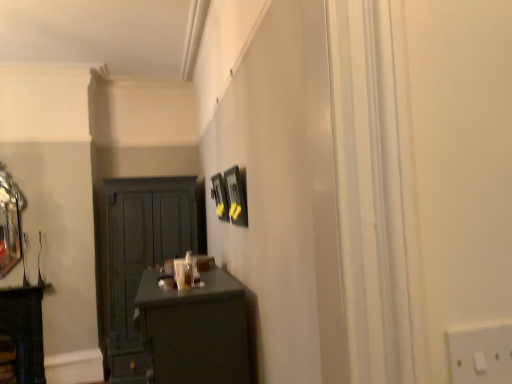
Question: Can you confirm if matte dark green cupboard at left is taller than polished silver mirror at left?

Choices:
 (A) yes
 (B) no

Answer: (A)

Question: Can you confirm if matte dark green cupboard at left is shorter than polished silver mirror at left?

Choices:
 (A) yes
 (B) no

Answer: (B)

Question: Is matte dark green cupboard at left looking in the opposite direction of polished silver mirror at left?

Choices:
 (A) yes
 (B) no

Answer: (B)

Question: Does matte dark green cupboard at left appear on the right side of polished silver mirror at left?

Choices:
 (A) yes
 (B) no

Answer: (A)

Question: Is matte dark green cupboard at left not near polished silver mirror at left?

Choices:
 (A) yes
 (B) no

Answer: (A)

Question: Is the position of matte dark green cupboard at left more distant than that of polished silver mirror at left?

Choices:
 (A) yes
 (B) no

Answer: (B)

Question: Is there a large distance between matte black picture frame at upper center, acting as the second picture frame starting from the front, and matte dark green cupboard at left?

Choices:
 (A) no
 (B) yes

Answer: (B)

Question: Is matte black picture frame at upper center, the second picture frame when ordered from right to left, beside matte dark green cupboard at left?

Choices:
 (A) yes
 (B) no

Answer: (B)

Question: Can you confirm if matte black picture frame at upper center, acting as the first picture frame starting from the left, is positioned to the right of matte dark green cupboard at left?

Choices:
 (A) no
 (B) yes

Answer: (B)

Question: From a real-world perspective, does matte black picture frame at upper center, the second picture frame when ordered from right to left, sit lower than matte dark green cupboard at left?

Choices:
 (A) yes
 (B) no

Answer: (B)

Question: Is matte black picture frame at upper center, acting as the first picture frame starting from the left, smaller than matte dark green cupboard at left?

Choices:
 (A) no
 (B) yes

Answer: (B)

Question: Does matte black picture frame at upper center, acting as the first picture frame starting from the left, have a greater height compared to matte dark green cupboard at left?

Choices:
 (A) no
 (B) yes

Answer: (A)

Question: From a real-world perspective, is matte black desk at lower left physically below matte black picture frame at center, which is the first picture frame in front-to-back order?

Choices:
 (A) no
 (B) yes

Answer: (B)